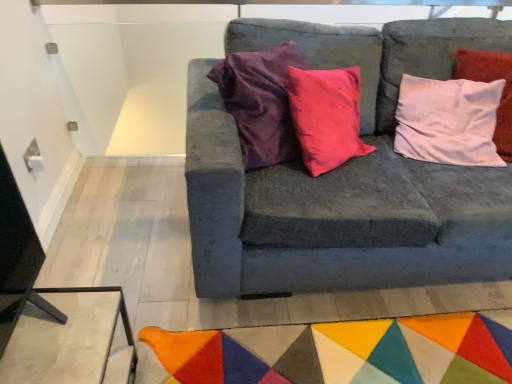
Question: Is multicolored felt mat at lower center not within velvet gray couch at center?

Choices:
 (A) yes
 (B) no

Answer: (A)

Question: From the image's perspective, is multicolored felt mat at lower center located above velvet gray couch at center?

Choices:
 (A) no
 (B) yes

Answer: (A)

Question: Can you confirm if multicolored felt mat at lower center is positioned to the left of velvet gray couch at center?

Choices:
 (A) no
 (B) yes

Answer: (B)

Question: From a real-world perspective, is multicolored felt mat at lower center on top of velvet gray couch at center?

Choices:
 (A) no
 (B) yes

Answer: (A)

Question: Is the position of multicolored felt mat at lower center more distant than that of velvet gray couch at center?

Choices:
 (A) no
 (B) yes

Answer: (B)

Question: Does multicolored felt mat at lower center appear on the right side of velvet gray couch at center?

Choices:
 (A) yes
 (B) no

Answer: (B)

Question: From a real-world perspective, is velvet gray couch at center on multicolored felt mat at lower center?

Choices:
 (A) no
 (B) yes

Answer: (B)

Question: From the image's perspective, is velvet gray couch at center beneath multicolored felt mat at lower center?

Choices:
 (A) yes
 (B) no

Answer: (B)

Question: Considering the relative positions of velvet gray couch at center and multicolored felt mat at lower center in the image provided, is velvet gray couch at center to the left of multicolored felt mat at lower center from the viewer's perspective?

Choices:
 (A) yes
 (B) no

Answer: (B)

Question: From a real-world perspective, is velvet gray couch at center positioned under multicolored felt mat at lower center based on gravity?

Choices:
 (A) no
 (B) yes

Answer: (A)

Question: Is the position of velvet gray couch at center less distant than that of multicolored felt mat at lower center?

Choices:
 (A) yes
 (B) no

Answer: (A)

Question: Is velvet gray couch at center further to the viewer compared to multicolored felt mat at lower center?

Choices:
 (A) yes
 (B) no

Answer: (B)

Question: Does point (412, 61) appear closer or farther from the camera than point (440, 354)?

Choices:
 (A) closer
 (B) farther

Answer: (B)